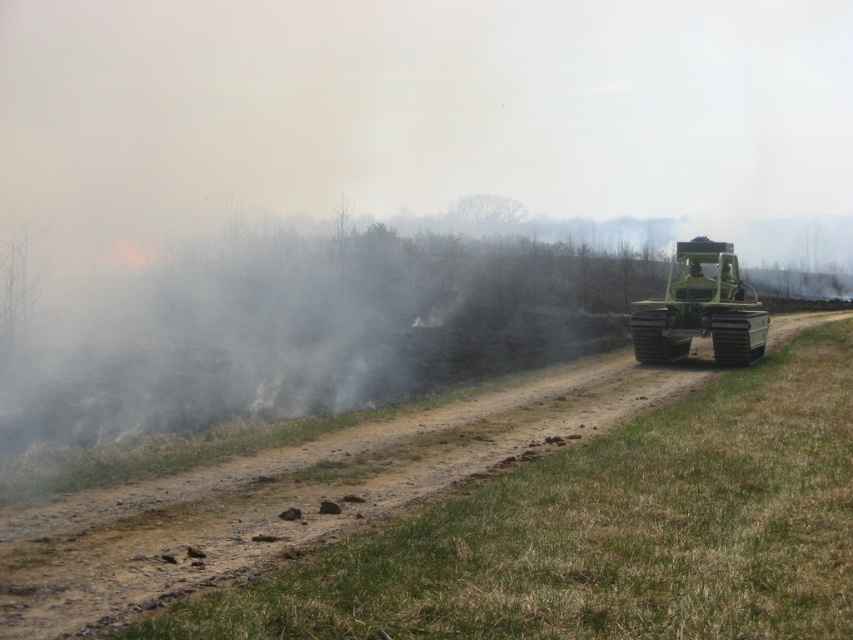
You are a firefighter assessing the terrain. You see the dull brown dirt at center and the green rubber tractor at right. Which object is positioned lower in the image?

The dull brown dirt at center is positioned lower than the green rubber tractor at right, as it is located below it in the scene.